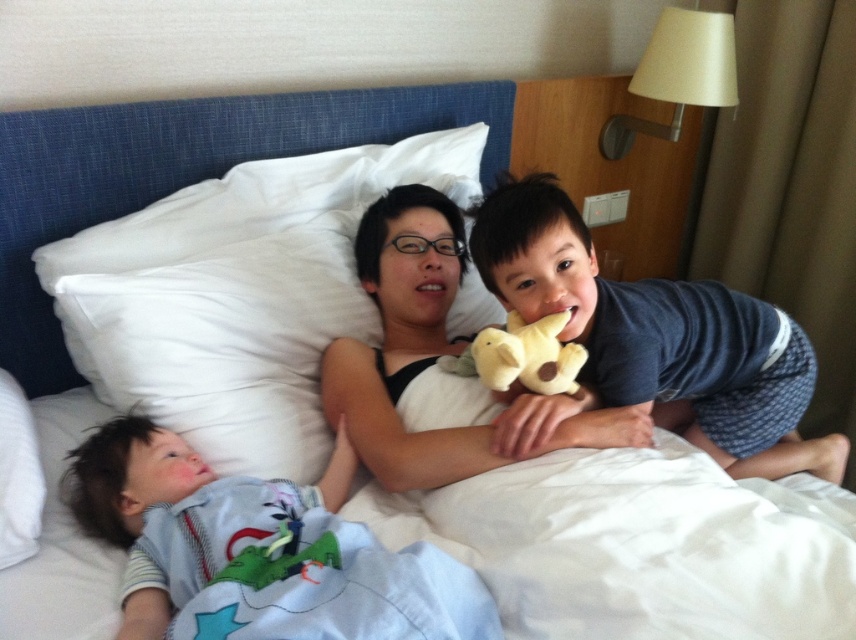
Question: Which object is farther from the camera taking this photo?

Choices:
 (A) soft yellow plush at center
 (B) white soft pillow at upper center

Answer: (B)

Question: Is dark blue cotton shirt at upper right thinner than soft yellow plush at center?

Choices:
 (A) yes
 (B) no

Answer: (B)

Question: Is white soft pillow at upper center to the right of soft yellow plush at center from the viewer's perspective?

Choices:
 (A) no
 (B) yes

Answer: (A)

Question: Which point is farther from the camera taking this photo?

Choices:
 (A) (550, 376)
 (B) (97, 346)
 (C) (185, 621)

Answer: (B)

Question: Among these points, which one is farthest from the camera?

Choices:
 (A) (568, 344)
 (B) (146, 422)
 (C) (289, 412)
 (D) (664, 404)

Answer: (D)

Question: In this image, where is white soft pillow at upper center located relative to soft yellow plush at center?

Choices:
 (A) above
 (B) below

Answer: (A)